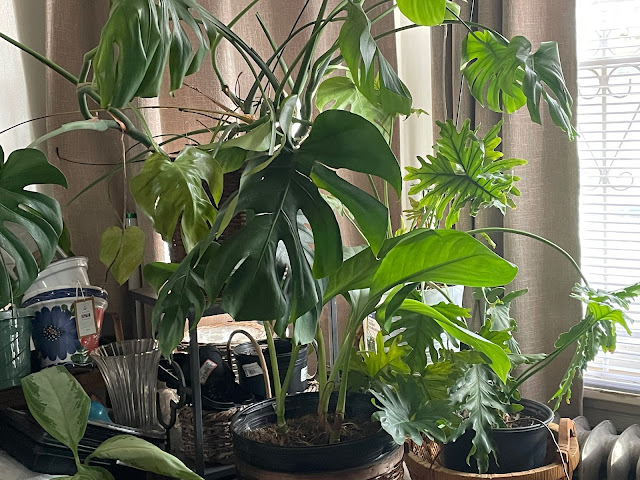
Where is `plastic plant pots`? plastic plant pots is located at coordinates (514, 435), (348, 454), (299, 366), (224, 379).